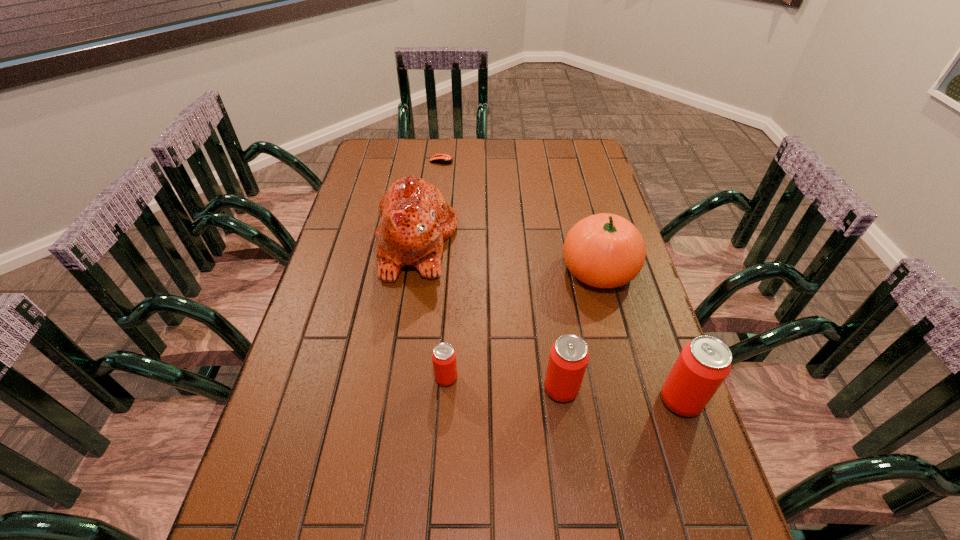
I want to click on the shortest beer can, so pyautogui.click(x=444, y=356).

At what (x,y) coordinates should I click in order to perform the action: click on the fifth tallest object. Please return your answer as a coordinate pair (x, y). Looking at the image, I should click on (444, 356).

Locate an element on the screen. the second beer can from left to right is located at coordinates (568, 359).

The image size is (960, 540). Find the location of `the third shortest object`. the third shortest object is located at coordinates (568, 359).

Where is `the rightmost beer can`? the rightmost beer can is located at coordinates (704, 363).

At what (x,y) coordinates should I click in order to perform the action: click on computer mouse. Please return your answer as a coordinate pair (x, y). The width and height of the screenshot is (960, 540). Looking at the image, I should click on (444, 159).

Where is `the farthest object`? the farthest object is located at coordinates (444, 159).

The image size is (960, 540). Identify the location of pumpkin. pyautogui.click(x=604, y=250).

Where is `cat`? The height and width of the screenshot is (540, 960). cat is located at coordinates (415, 219).

This screenshot has height=540, width=960. Identify the location of vacant space situated on the left of the second shortest object. (317, 377).